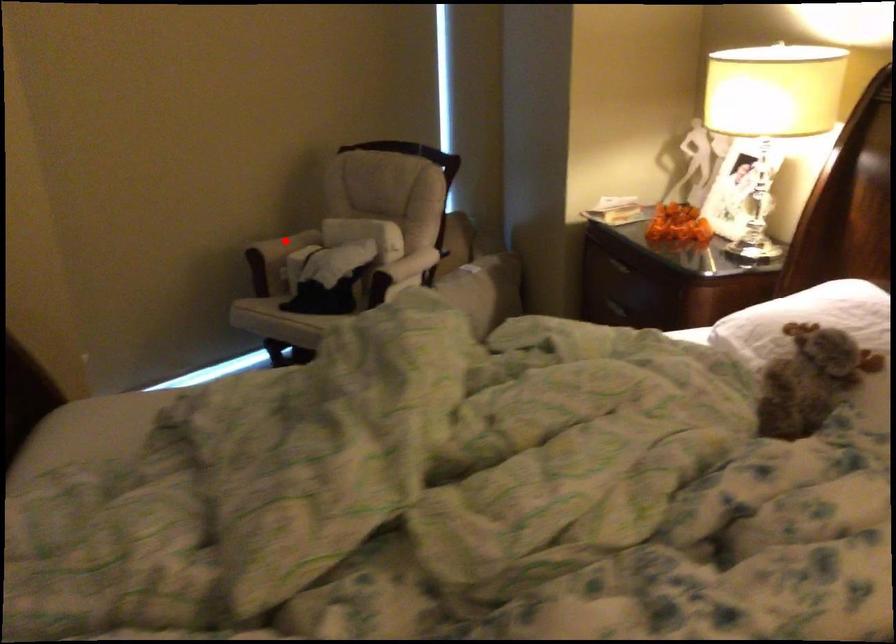
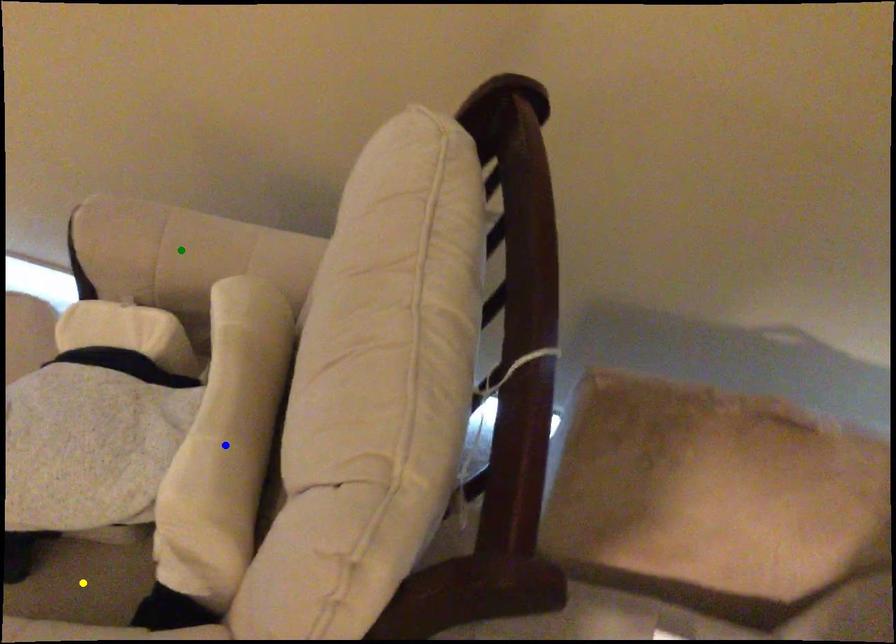
Question: I am providing you with two images of the same scene from different viewpoints. A red point is marked on the first image. You are given multiple points on the second image. Which mark in image 2 goes with the point in image 1?

Choices:
 (A) yellow point
 (B) blue point
 (C) green point

Answer: (C)